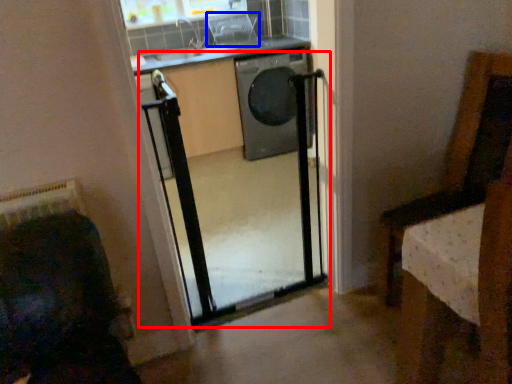
Question: Which object is closer to the camera taking this photo, screen door (highlighted by a red box) or armchair (highlighted by a blue box)?

Choices:
 (A) screen door
 (B) armchair

Answer: (A)